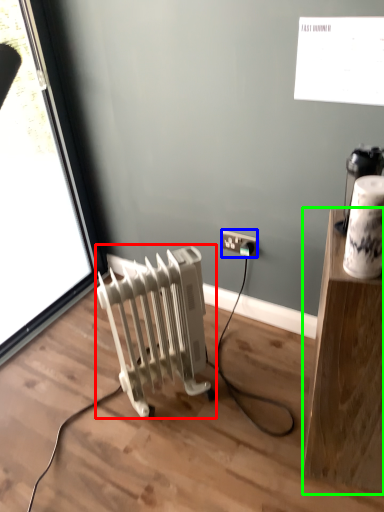
Question: Which object is the farthest from radiator (highlighted by a red box)? Choose among these: power plugs and sockets (highlighted by a blue box) or furniture (highlighted by a green box).

Choices:
 (A) power plugs and sockets
 (B) furniture

Answer: (B)